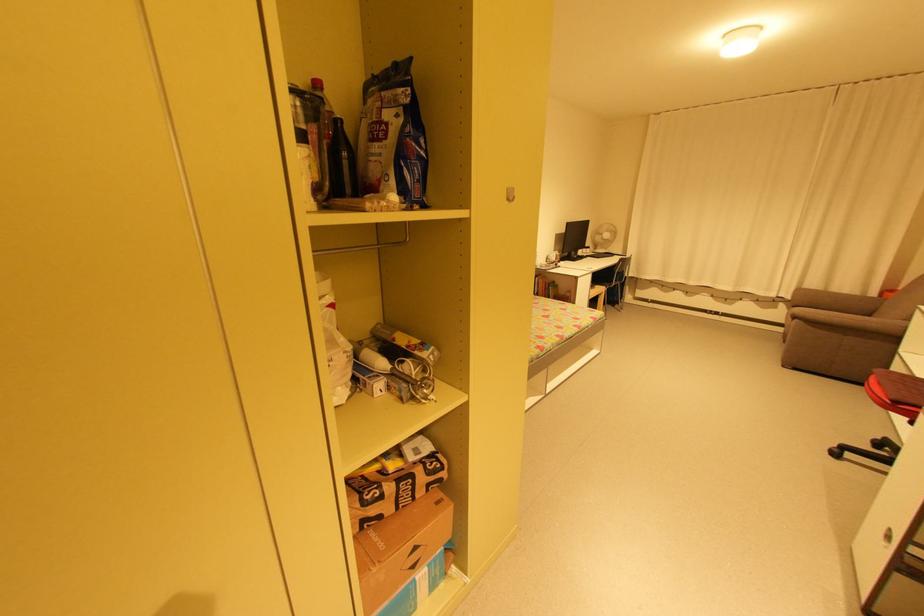
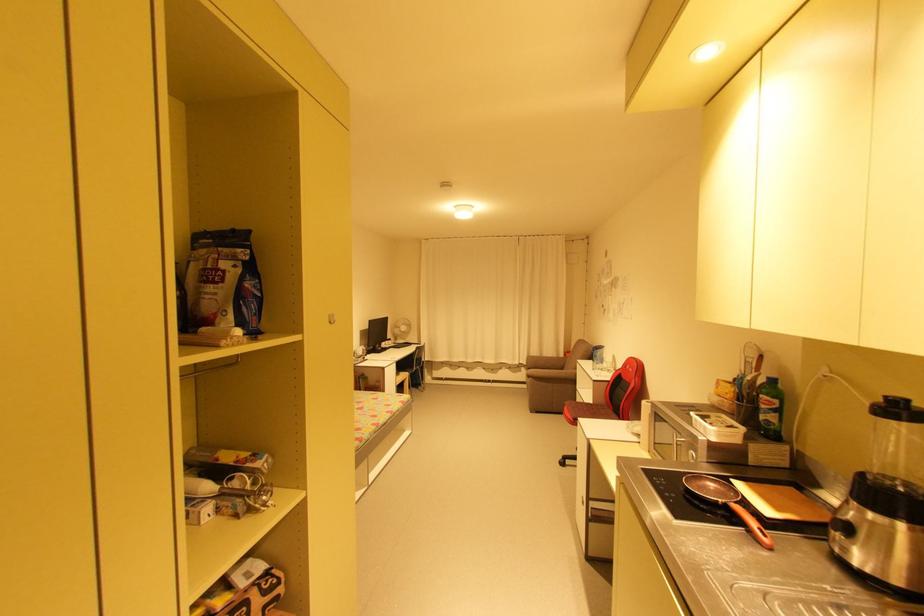
Locate, in the second image, the point that corresponds to the point at 383,140 in the first image.

(220, 283)